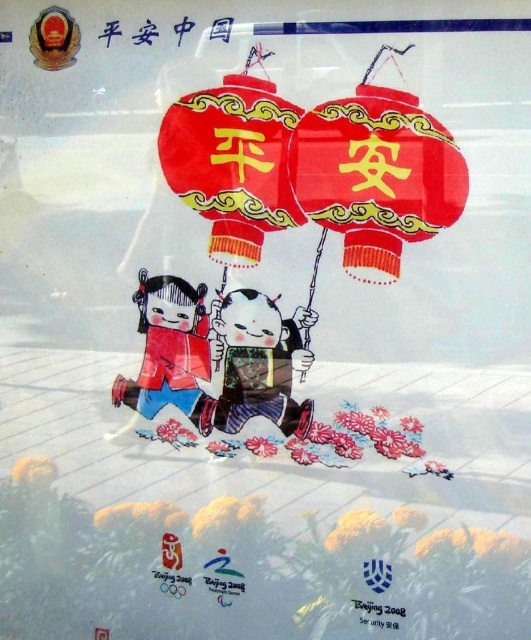
Between matte red paper doll at lower left and black paper at lower right, which one is positioned lower?

black paper at lower right is lower down.

Measure the distance between matte red paper doll at lower left and black paper at lower right.

matte red paper doll at lower left is 75.77 centimeters from black paper at lower right.

Which is behind, point (169, 305) or point (363, 618)?

Point (169, 305)

Where is `matte red paper doll at lower left`? The width and height of the screenshot is (531, 640). matte red paper doll at lower left is located at coordinates (169, 349).

Can you confirm if red glossy paper lantern at center is thinner than black paper at lower right?

No, red glossy paper lantern at center is not thinner than black paper at lower right.

Is red glossy paper lantern at center positioned at the back of black paper at lower right?

Yes, it is behind black paper at lower right.

Between point (288, 120) and point (386, 624), which one is positioned in front?

Point (386, 624) is more forward.

Where is `red glossy paper lantern at center`? red glossy paper lantern at center is located at coordinates (x=233, y=163).

Who is higher up, red glossy paper lantern at upper center or silky fabric geisha at center?

red glossy paper lantern at upper center is above.

Is point (321, 204) in front of point (246, 328)?

Yes, it is in front of point (246, 328).

Identify the location of red glossy paper lantern at upper center. (376, 177).